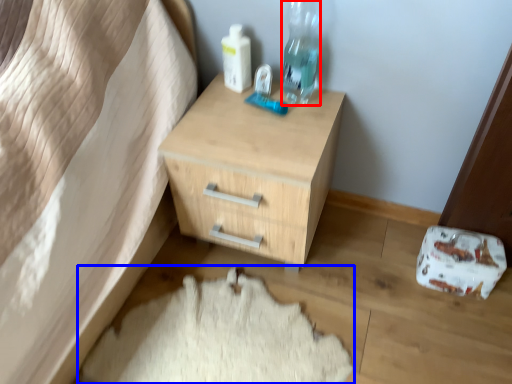
Question: Which of the following is the closest to the observer, bottle (highlighted by a red box) or sheet (highlighted by a blue box)?

Choices:
 (A) bottle
 (B) sheet

Answer: (B)